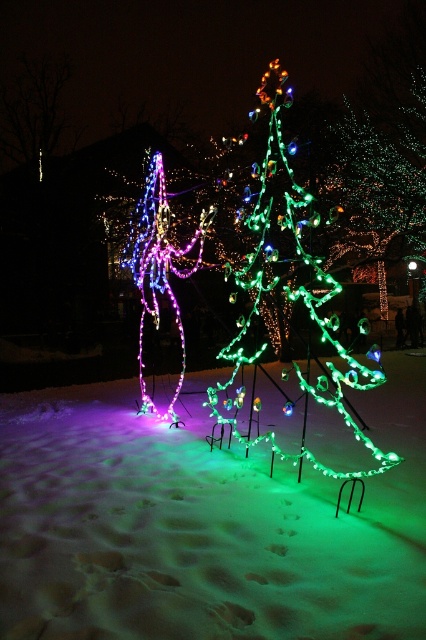
Does green illuminated tree at center appear on the left side of illuminated plastic christmas tree at center?

In fact, green illuminated tree at center is to the right of illuminated plastic christmas tree at center.

In the scene shown: Can you confirm if green illuminated tree at center is shorter than illuminated plastic christmas tree at center?

Yes, green illuminated tree at center is shorter than illuminated plastic christmas tree at center.

Is point (215, 264) farther from camera compared to point (135, 225)?

That is True.

Find the location of a particular element. The image size is (426, 640). green illuminated tree at center is located at coordinates (244, 289).

Consider the image. Does green frosted snow at lower center come behind green illuminated tree at center?

No, green frosted snow at lower center is in front of green illuminated tree at center.

Find the location of a particular element. green frosted snow at lower center is located at coordinates (201, 525).

What do you see at coordinates (201, 525) in the screenshot?
I see `green frosted snow at lower center` at bounding box center [201, 525].

At what (x,y) coordinates should I click in order to perform the action: click on green frosted snow at lower center. Please return your answer as a coordinate pair (x, y). The height and width of the screenshot is (640, 426). Looking at the image, I should click on (201, 525).